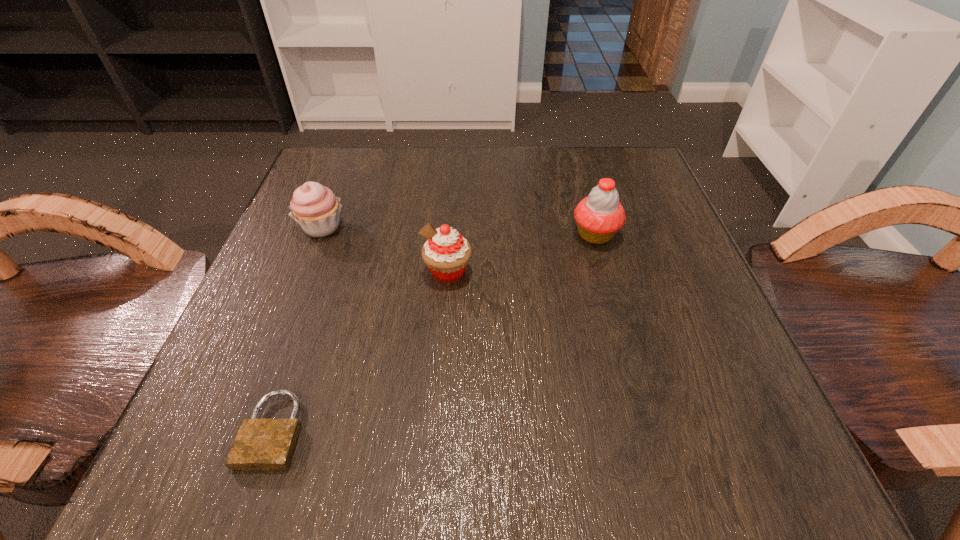
Identify the location of the second closest object to the rightmost cupcake. (315, 207).

Point out which object is positioned as the nearest to the rightmost object. Please provide its 2D coordinates. Your answer should be formatted as a tuple, i.e. [(x, y)], where the tuple contains the x and y coordinates of a point satisfying the conditions above.

[(446, 253)]

Where is `the closest cupcake to the rightmost object`? the closest cupcake to the rightmost object is located at coordinates (446, 253).

Point out which cupcake is positioned as the second nearest to the second object from right to left. Please provide its 2D coordinates. Your answer should be formatted as a tuple, i.e. [(x, y)], where the tuple contains the x and y coordinates of a point satisfying the conditions above.

[(599, 216)]

The height and width of the screenshot is (540, 960). What are the coordinates of `vacant space that satisfies the following two spatial constraints: 1. on the front side of the rightmost cupcake; 2. on the right side of the leftmost cupcake` in the screenshot? It's located at (319, 234).